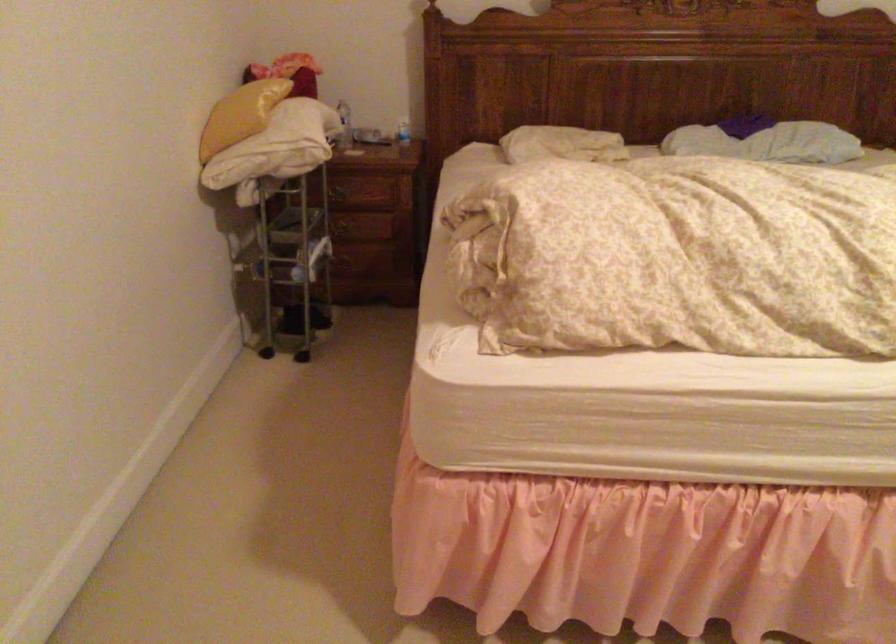
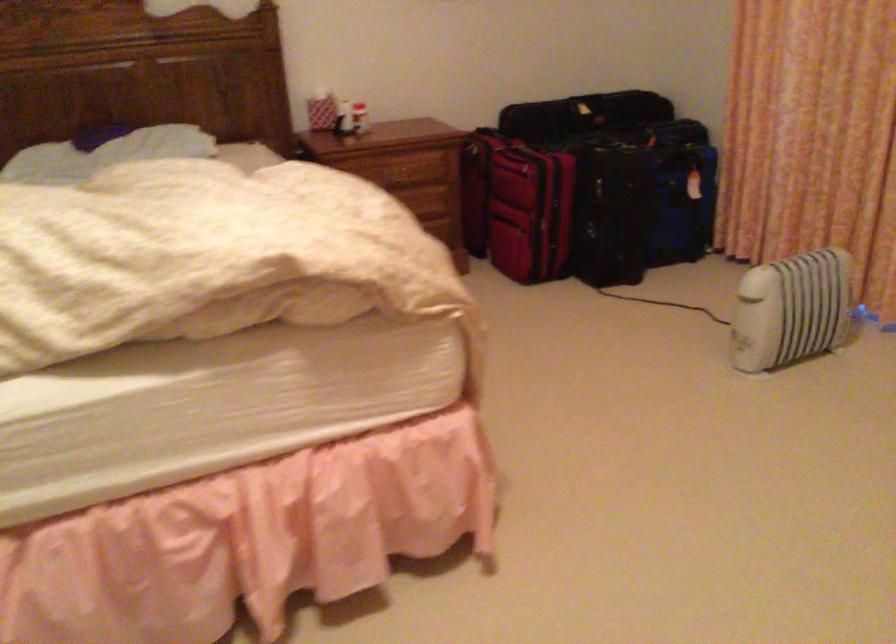
Question: The camera is either moving clockwise (left) or counter-clockwise (right) around the object. The first image is from the beginning of the video and the second image is from the end. Is the camera moving left or right when shooting the video?

Choices:
 (A) Left
 (B) Right

Answer: (A)